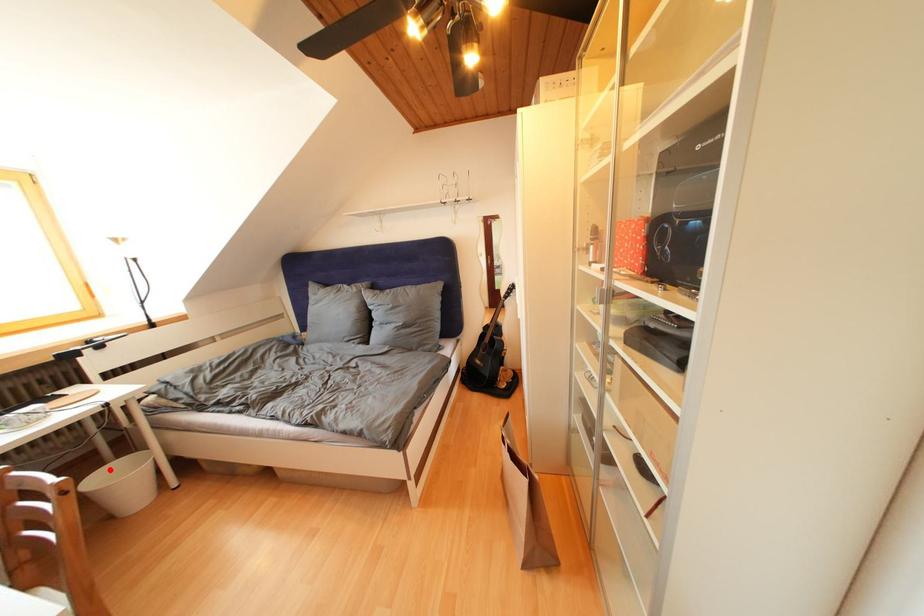
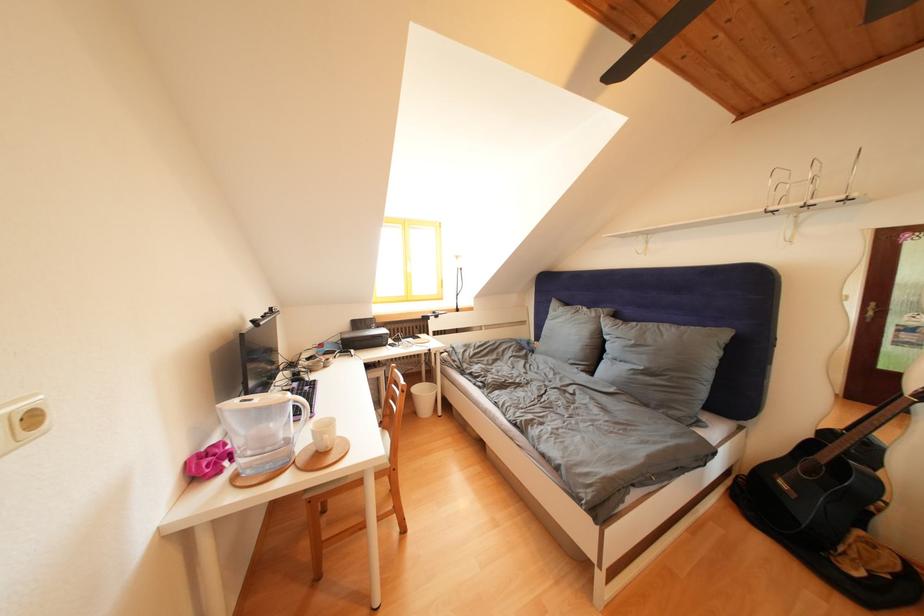
Question: A red point is marked in image1. In image2, is the corresponding 3D point closer to the camera or farther? Reply with the corresponding letter.

Choices:
 (A) The corresponding 3D point is closer.
 (B) The corresponding 3D point is farther.

Answer: (A)